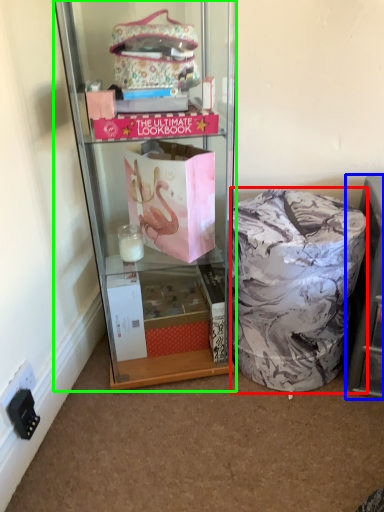
Question: Which is farther away from material (highlighted by a red box)? shelf (highlighted by a blue box) or cabinetry (highlighted by a green box)?

Choices:
 (A) shelf
 (B) cabinetry

Answer: (B)